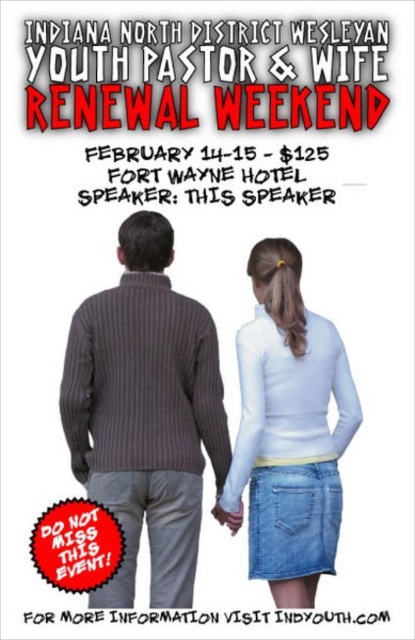
Question: Can you confirm if black paper text at center is wider than white paper at center?

Choices:
 (A) no
 (B) yes

Answer: (A)

Question: Is white matte turtleneck at center positioned before white matte hand at center?

Choices:
 (A) yes
 (B) no

Answer: (A)

Question: Which of the following is the closest to the observer?

Choices:
 (A) white paper at center
 (B) ribbed brown sweater at center
 (C) black paper text at center

Answer: (B)

Question: Which point is closer to the camera taking this photo?

Choices:
 (A) (246, 356)
 (B) (183, 392)
 (C) (270, 170)
 (D) (234, 531)

Answer: (B)

Question: Estimate the real-world distances between objects in this image. Which object is farther from the ribbed brown sweater at center?

Choices:
 (A) white matte hand at center
 (B) white matte turtleneck at center
 (C) white paper at center
 (D) black paper text at center

Answer: (D)

Question: Is white matte turtleneck at center bigger than white paper at center?

Choices:
 (A) yes
 (B) no

Answer: (B)